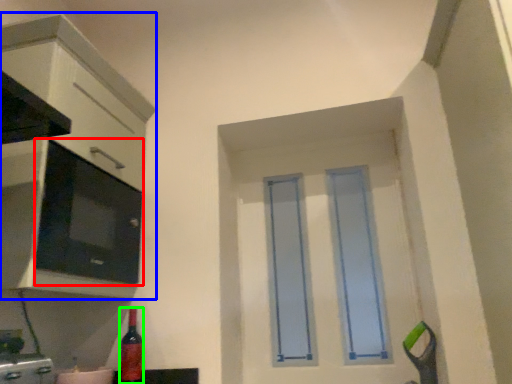
Question: Which object is the farthest from appliance (highlighted by a red box)? Choose among these: cabinetry (highlighted by a blue box) or bottle (highlighted by a green box).

Choices:
 (A) cabinetry
 (B) bottle

Answer: (B)